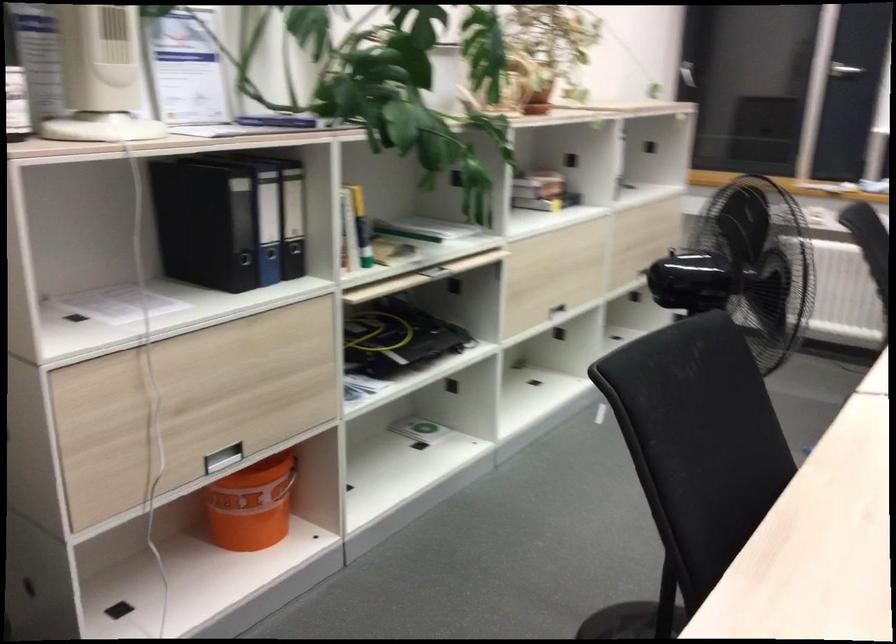
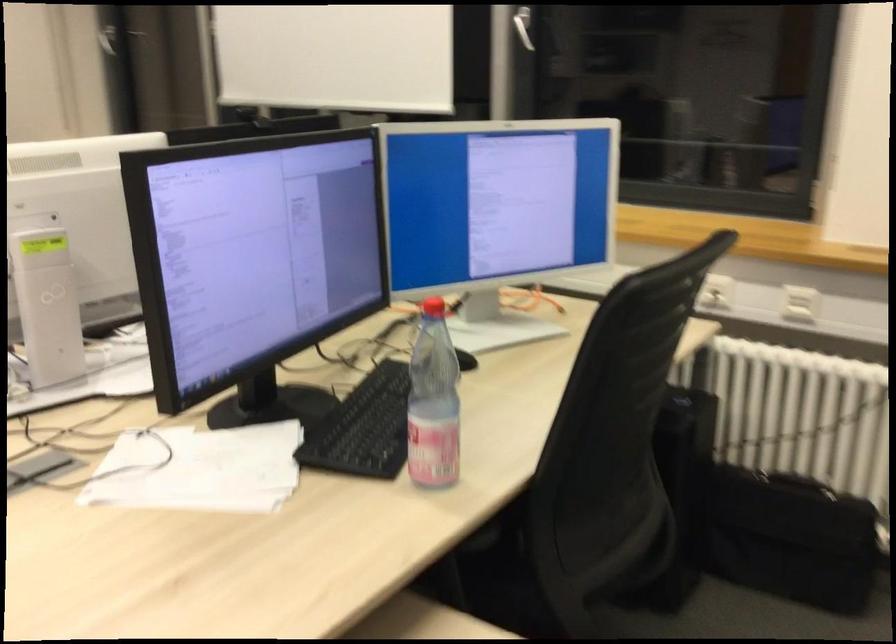
Question: The images are taken continuously from a first-person perspective. In which direction are you moving?

Choices:
 (A) Left
 (B) Right
 (C) Forward
 (D) Backward

Answer: (B)